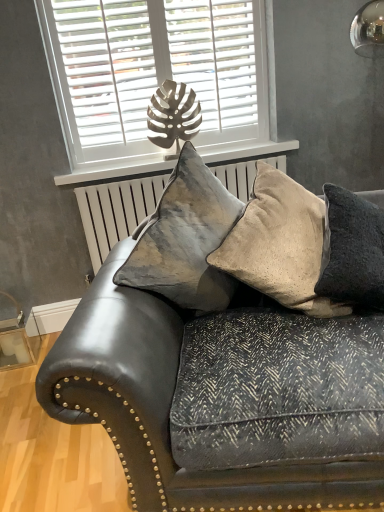
The width and height of the screenshot is (384, 512). Describe the element at coordinates (117, 170) in the screenshot. I see `white matte window sill at upper center` at that location.

In order to face leather couch at center, should I rotate leftwards or rightwards?

You should look right and rotate roughly 9.197 degrees.

Locate an element on the screen. beige textured cushion at right, marked as the third pillow in a left-to-right arrangement is located at coordinates (352, 251).

What are the coordinates of `white matte window at upper center` in the screenshot? It's located at (155, 70).

Locate an element on the screen. white matte window sill at upper center is located at coordinates (117, 170).

In the scene shown: Can you confirm if beige textured cushion at right, marked as the third pillow in a left-to-right arrangement, is thinner than white matte window sill at upper center?

In fact, beige textured cushion at right, marked as the third pillow in a left-to-right arrangement, might be wider than white matte window sill at upper center.

Looking at the image, does beige textured cushion at right, which appears as the 1th pillow when viewed from the right, seem bigger or smaller compared to white matte window sill at upper center?

beige textured cushion at right, which appears as the 1th pillow when viewed from the right, is bigger than white matte window sill at upper center.

Do you think beige textured cushion at right, marked as the third pillow in a left-to-right arrangement, is within white matte window sill at upper center, or outside of it?

beige textured cushion at right, marked as the third pillow in a left-to-right arrangement, lies outside white matte window sill at upper center.

From the image's perspective, is white matte window sill at upper center above or below leather couch at center?

white matte window sill at upper center is situated higher than leather couch at center in the image.

Is white matte window sill at upper center in front of or behind leather couch at center in the image?

Visually, white matte window sill at upper center is located behind leather couch at center.

Is white matte window sill at upper center situated inside leather couch at center or outside?

The correct answer is: outside.

How distant is white matte window at upper center from velvet beige pillow at center, which is the second pillow in right-to-left order?

white matte window at upper center and velvet beige pillow at center, which is the second pillow in right-to-left order, are 3.49 feet apart.

Does white matte window at upper center appear on the left side of velvet beige pillow at center, the second pillow positioned from the left?

Indeed, white matte window at upper center is positioned on the left side of velvet beige pillow at center, the second pillow positioned from the left.

Identify the location of window above the velvet beige pillow at center, the second pillow positioned from the left (from the image's perspective). The height and width of the screenshot is (512, 384). (155, 70).

Which object is more forward, white matte window at upper center or velvet beige pillow at center, the second pillow positioned from the left?

velvet beige pillow at center, the second pillow positioned from the left, is in front.

Based on the photo, from the image's perspective, is white matte window at upper center below white matte window sill at upper center?

Incorrect, from the image's perspective, white matte window at upper center is higher than white matte window sill at upper center.

Which object is closer to the camera, white matte window at upper center or white matte window sill at upper center?

white matte window at upper center is more forward.

Between white matte window at upper center and white matte window sill at upper center, which one has more height?

white matte window at upper center is taller.

Considering the positions of points (108, 159) and (119, 167), is point (108, 159) closer to camera compared to point (119, 167)?

No, (108, 159) is further to viewer.

Would you say velvet beige pillow at center, which is the second pillow in right-to-left order, is to the left or to the right of leather couch at center in the picture?

From the image, it's evident that velvet beige pillow at center, which is the second pillow in right-to-left order, is to the right of leather couch at center.

Is velvet beige pillow at center, the second pillow positioned from the left, far from leather couch at center?

That's not correct — velvet beige pillow at center, the second pillow positioned from the left, is a little close to leather couch at center.

Which of these two, velvet beige pillow at center, which is the second pillow in right-to-left order, or leather couch at center, is wider?

leather couch at center.

Does velvet beige pillow at center, the second pillow positioned from the left, turn towards leather couch at center?

Yes, velvet beige pillow at center, the second pillow positioned from the left, is turned towards leather couch at center.

Considering the sizes of leather couch at center and white matte window sill at upper center in the image, is leather couch at center taller or shorter than white matte window sill at upper center?

Considering their sizes, leather couch at center has more height than white matte window sill at upper center.

Which object is wider, leather couch at center or white matte window sill at upper center?

With larger width is leather couch at center.

From the image's perspective, between leather couch at center and white matte window sill at upper center, who is located below?

From the image's view, leather couch at center is below.

What are the coordinates of `studio couch below the velvet cushion at center, positioned as the 1th pillow in left-to-right order (from the image's perspective)` in the screenshot? It's located at (224, 398).

Is leather couch at center at the left side of velvet cushion at center, positioned as the 1th pillow in left-to-right order?

In fact, leather couch at center is to the right of velvet cushion at center, positioned as the 1th pillow in left-to-right order.

Between point (117, 365) and point (177, 245), which one is positioned in front?

The point (117, 365) is closer to the camera.

Locate an element on the screen. The height and width of the screenshot is (512, 384). window sill on the left side of beige textured cushion at right, marked as the third pillow in a left-to-right arrangement is located at coordinates (117, 170).

At what (x,y) coordinates should I click in order to perform the action: click on window sill that appears above the leather couch at center (from a real-world perspective). Please return your answer as a coordinate pair (x, y). Looking at the image, I should click on (117, 170).

Considering their positions, is beige textured cushion at right, marked as the third pillow in a left-to-right arrangement, positioned further to velvet cushion at center, which appears as the 3th pillow when viewed from the right, than velvet beige pillow at center, the second pillow positioned from the left?

beige textured cushion at right, marked as the third pillow in a left-to-right arrangement, is further to velvet cushion at center, which appears as the 3th pillow when viewed from the right.

Estimate the real-world distances between objects in this image. Which object is closer to white matte window sill at upper center, leather couch at center or white matte window at upper center?

Based on the image, white matte window at upper center appears to be nearer to white matte window sill at upper center.

Looking at the image, which one is located further to white matte window sill at upper center, leather couch at center or velvet cushion at center, positioned as the 1th pillow in left-to-right order?

Among the two, leather couch at center is located further to white matte window sill at upper center.

From the image, which object appears to be nearer to leather couch at center, white matte window sill at upper center or velvet cushion at center, which appears as the 3th pillow when viewed from the right?

velvet cushion at center, which appears as the 3th pillow when viewed from the right.

Considering their positions, is white matte window at upper center positioned closer to white matte window sill at upper center than velvet cushion at center, positioned as the 1th pillow in left-to-right order?

Based on the image, white matte window at upper center appears to be nearer to white matte window sill at upper center.

Looking at the image, which one is located further to leather couch at center, beige textured cushion at right, which appears as the 1th pillow when viewed from the right, or white matte window at upper center?

white matte window at upper center.

Which object lies further to the anchor point velvet beige pillow at center, the second pillow positioned from the left, beige textured cushion at right, marked as the third pillow in a left-to-right arrangement, or velvet cushion at center, which appears as the 3th pillow when viewed from the right?

velvet cushion at center, which appears as the 3th pillow when viewed from the right, lies further to velvet beige pillow at center, the second pillow positioned from the left, than the other object.

Considering their positions, is white matte window at upper center positioned further to beige textured cushion at right, which appears as the 1th pillow when viewed from the right, than velvet cushion at center, positioned as the 1th pillow in left-to-right order?

The object further to beige textured cushion at right, which appears as the 1th pillow when viewed from the right, is white matte window at upper center.

Image resolution: width=384 pixels, height=512 pixels. Find the location of `pillow between velvet cushion at center, positioned as the 1th pillow in left-to-right order, and white matte window sill at upper center from front to back`. pillow between velvet cushion at center, positioned as the 1th pillow in left-to-right order, and white matte window sill at upper center from front to back is located at coordinates (279, 244).

Where is `window between beige textured cushion at right, marked as the third pillow in a left-to-right arrangement, and white matte window sill at upper center in the front-back direction`? The height and width of the screenshot is (512, 384). window between beige textured cushion at right, marked as the third pillow in a left-to-right arrangement, and white matte window sill at upper center in the front-back direction is located at coordinates (155, 70).

The width and height of the screenshot is (384, 512). Find the location of `studio couch between velvet cushion at center, which appears as the 3th pillow when viewed from the right, and beige textured cushion at right, which appears as the 1th pillow when viewed from the right, from left to right`. studio couch between velvet cushion at center, which appears as the 3th pillow when viewed from the right, and beige textured cushion at right, which appears as the 1th pillow when viewed from the right, from left to right is located at coordinates (224, 398).

Where is `window located between velvet beige pillow at center, the second pillow positioned from the left, and white matte window sill at upper center in the depth direction`? window located between velvet beige pillow at center, the second pillow positioned from the left, and white matte window sill at upper center in the depth direction is located at coordinates (155, 70).